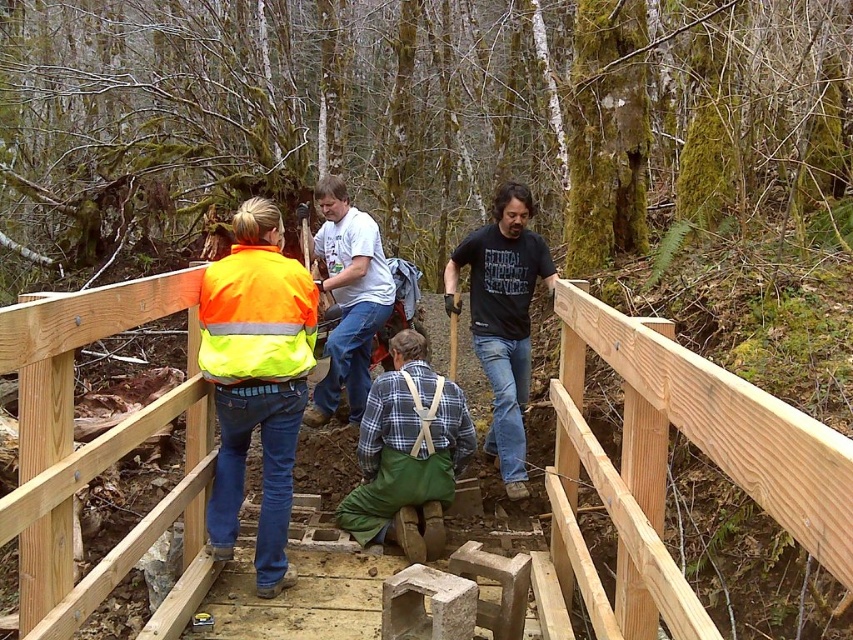
Who is more distant from viewer, (712, 433) or (527, 240)?

The point (527, 240) is more distant.

This screenshot has width=853, height=640. I want to click on natural wood bridge at center, so click(665, 460).

Consider the image. Measure the distance between point (781, 401) and camera.

Point (781, 401) is 4.89 feet away from camera.

This screenshot has width=853, height=640. In order to click on natural wood bridge at center in this screenshot , I will do `click(665, 460)`.

Is neon yellow reflective jacket at center above white t-shirt at center?

Actually, neon yellow reflective jacket at center is below white t-shirt at center.

How distant is neon yellow reflective jacket at center from white t-shirt at center?

The distance of neon yellow reflective jacket at center from white t-shirt at center is 1.61 meters.

Which is in front, point (281, 460) or point (350, 292)?

Point (281, 460) is in front.

The height and width of the screenshot is (640, 853). What are the coordinates of `neon yellow reflective jacket at center` in the screenshot? It's located at (256, 380).

Which of these two, black cotton t-shirt at center or white t-shirt at center, stands shorter?

white t-shirt at center is shorter.

Which is behind, point (508, 429) or point (328, 193)?

The point (328, 193) is more distant.

Is point (497, 380) farther from viewer compared to point (341, 248)?

No, it is in front of (341, 248).

Where is `black cotton t-shirt at center`? The height and width of the screenshot is (640, 853). black cotton t-shirt at center is located at coordinates (503, 317).